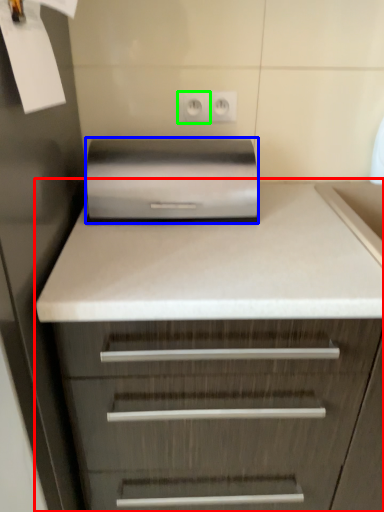
Question: Considering the real-world distances, which object is farthest from chest of drawers (highlighted by a red box)? home appliance (highlighted by a blue box) or electric outlet (highlighted by a green box)?

Choices:
 (A) home appliance
 (B) electric outlet

Answer: (B)